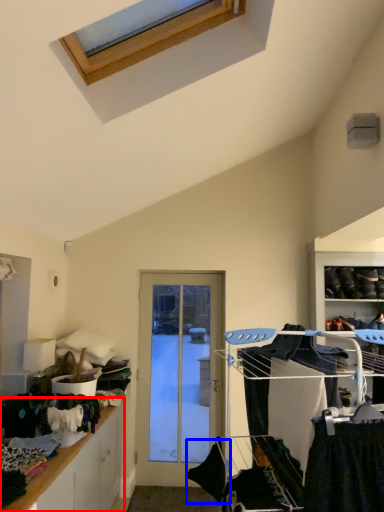
Question: Which object appears farthest to the camera in this image, cabinetry (highlighted by a red box) or clothing (highlighted by a blue box)?

Choices:
 (A) cabinetry
 (B) clothing

Answer: (B)